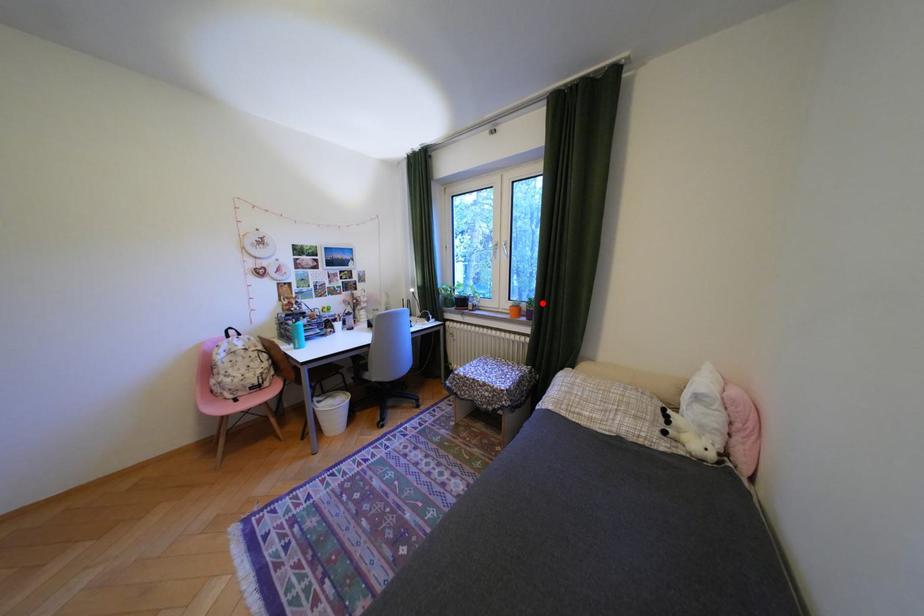
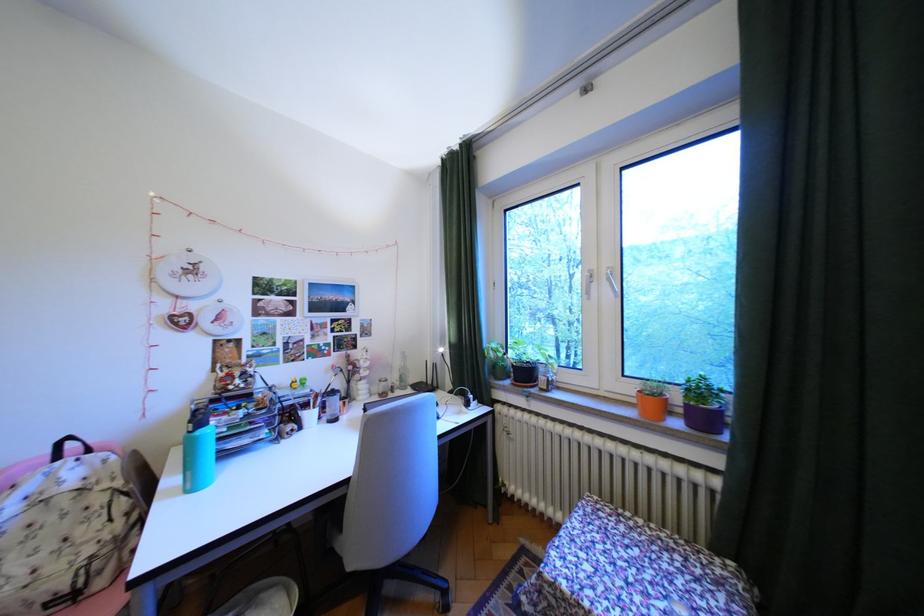
Find the pixel in the second image that matches the highlighted location in the first image.

(710, 391)